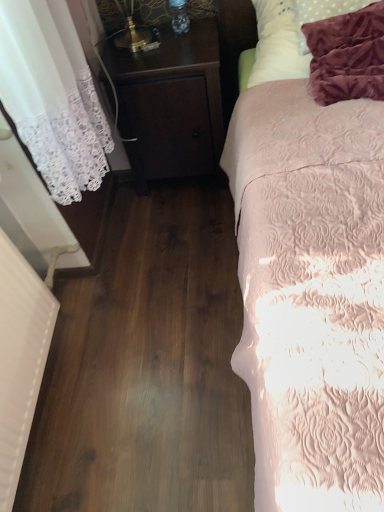
Question: Would you say white soft pillow at upper right is a long distance from pink quilted bed at right?

Choices:
 (A) no
 (B) yes

Answer: (A)

Question: Is white soft pillow at upper right completely or partially outside of pink quilted bed at right?

Choices:
 (A) yes
 (B) no

Answer: (B)

Question: Does white soft pillow at upper right have a greater width compared to pink quilted bed at right?

Choices:
 (A) no
 (B) yes

Answer: (A)

Question: Can you confirm if white soft pillow at upper right is bigger than pink quilted bed at right?

Choices:
 (A) no
 (B) yes

Answer: (A)

Question: Does white soft pillow at upper right lie in front of pink quilted bed at right?

Choices:
 (A) no
 (B) yes

Answer: (A)

Question: Considering the relative sizes of white soft pillow at upper right and pink quilted bed at right in the image provided, is white soft pillow at upper right smaller than pink quilted bed at right?

Choices:
 (A) no
 (B) yes

Answer: (B)

Question: Is pink quilted bed at right closer to the viewer compared to dark wood nightstand at center?

Choices:
 (A) no
 (B) yes

Answer: (B)

Question: Could you tell me if pink quilted bed at right is turned towards dark wood nightstand at center?

Choices:
 (A) yes
 (B) no

Answer: (B)

Question: Is pink quilted bed at right smaller than dark wood nightstand at center?

Choices:
 (A) no
 (B) yes

Answer: (A)

Question: Does pink quilted bed at right have a larger size compared to dark wood nightstand at center?

Choices:
 (A) no
 (B) yes

Answer: (B)

Question: From a real-world perspective, is pink quilted bed at right positioned under dark wood nightstand at center based on gravity?

Choices:
 (A) yes
 (B) no

Answer: (B)

Question: Does pink quilted bed at right contain dark wood nightstand at center?

Choices:
 (A) yes
 (B) no

Answer: (B)

Question: Is dark wood nightstand at center positioned before white soft pillow at upper right?

Choices:
 (A) no
 (B) yes

Answer: (A)